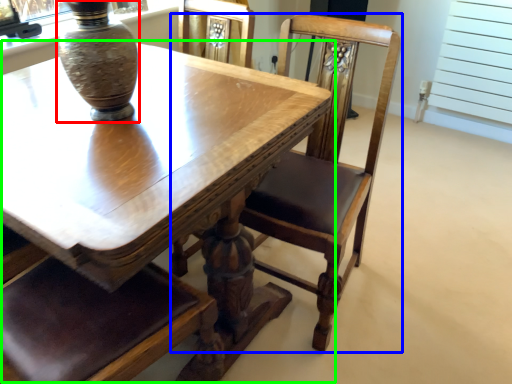
Question: Which object is positioned farthest from vase (highlighted by a red box)? Select from chair (highlighted by a blue box) and table (highlighted by a green box).

Choices:
 (A) chair
 (B) table

Answer: (A)